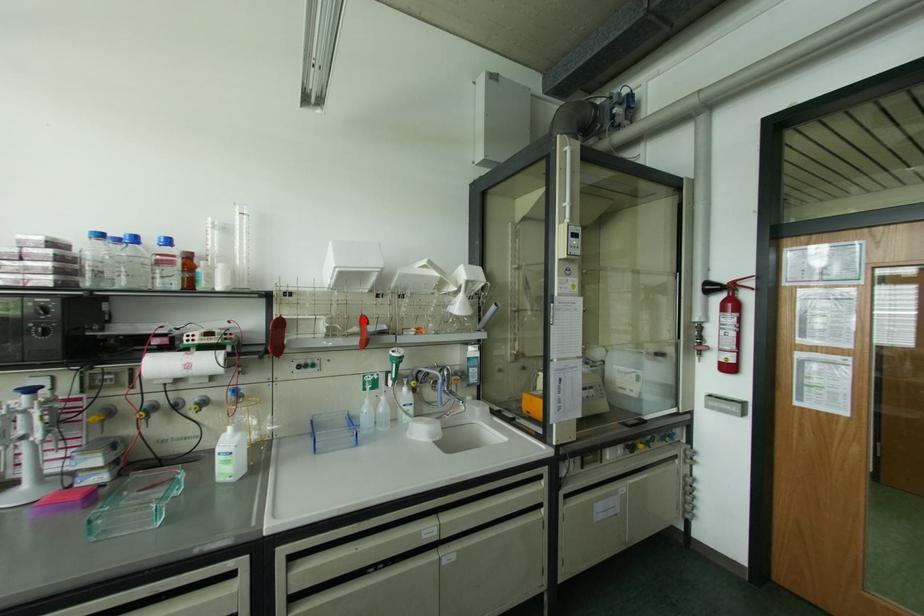
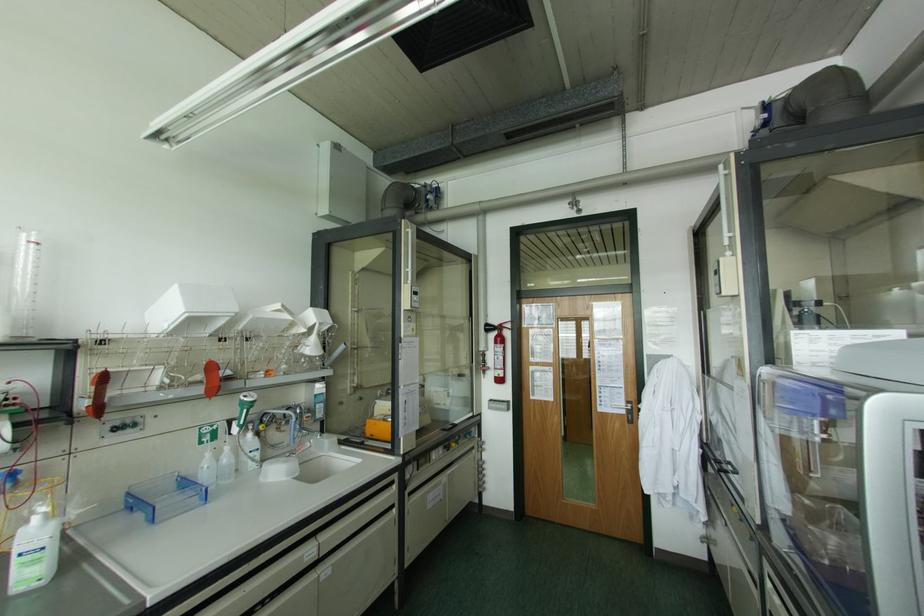
Find the pixel in the second image that matches the highlighted location in the first image.

(211, 368)